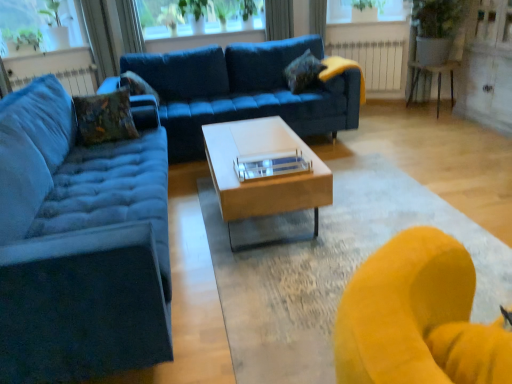
Question: Considering the relative sizes of velvet textured pillow at upper center, positioned as the third pillow in left-to-right order, and velvet blue couch at left, which is counted as the 2th studio couch, starting from the back, in the image provided, is velvet textured pillow at upper center, positioned as the third pillow in left-to-right order, wider than velvet blue couch at left, which is counted as the 2th studio couch, starting from the back,?

Choices:
 (A) no
 (B) yes

Answer: (A)

Question: Does velvet textured pillow at upper center, the third pillow in the front-to-back sequence, have a larger size compared to velvet blue couch at left, the 1th studio couch from the front?

Choices:
 (A) yes
 (B) no

Answer: (B)

Question: Can you confirm if velvet textured pillow at upper center, the third pillow in the front-to-back sequence, is positioned to the right of velvet blue couch at left, the 1th studio couch from the front?

Choices:
 (A) yes
 (B) no

Answer: (A)

Question: Could velvet blue couch at left, which is counted as the 2th studio couch, starting from the back, be considered to be inside velvet textured pillow at upper center, the 1th pillow from the right?

Choices:
 (A) no
 (B) yes

Answer: (A)

Question: Is velvet textured pillow at upper center, the third pillow in the front-to-back sequence, in front of velvet blue couch at left, which is counted as the 2th studio couch, starting from the back?

Choices:
 (A) yes
 (B) no

Answer: (B)

Question: In terms of size, does transparent glass window screen at upper left, marked as the second window screen in a right-to-left arrangement, appear bigger or smaller than velvet textured pillow at upper left, which is counted as the 2th pillow, starting from the right?

Choices:
 (A) big
 (B) small

Answer: (A)

Question: From a real-world perspective, is transparent glass window screen at upper left, which is the first window screen in left-to-right order, positioned above or below velvet textured pillow at upper left, which is the second pillow from front to back?

Choices:
 (A) below
 (B) above

Answer: (B)

Question: Is point (57, 6) closer or farther from the camera than point (134, 74)?

Choices:
 (A) farther
 (B) closer

Answer: (A)

Question: From their relative heights in the image, would you say transparent glass window screen at upper left, marked as the second window screen in a right-to-left arrangement, is taller or shorter than velvet textured pillow at upper left, which is the second pillow from front to back?

Choices:
 (A) tall
 (B) short

Answer: (A)

Question: From the image's perspective, is white metallic radiator at upper left, positioned as the first radiator in left-to-right order, above or below white glossy coffee table at center?

Choices:
 (A) above
 (B) below

Answer: (A)

Question: From a real-world perspective, is white metallic radiator at upper left, the 2th radiator in the back-to-front sequence, physically located above or below white glossy coffee table at center?

Choices:
 (A) above
 (B) below

Answer: (A)

Question: Considering their positions, is white metallic radiator at upper left, the 2th radiator in the back-to-front sequence, located in front of or behind white glossy coffee table at center?

Choices:
 (A) front
 (B) behind

Answer: (B)

Question: Is white metallic radiator at upper left, the second radiator positioned from the right, wider or thinner than white glossy coffee table at center?

Choices:
 (A) wide
 (B) thin

Answer: (B)

Question: Looking at their shapes, would you say white metallic radiator at center, which is counted as the second radiator, starting from the front, is wider or thinner than velvet textured pillow at upper left, which is the second pillow from front to back?

Choices:
 (A) wide
 (B) thin

Answer: (B)

Question: Considering the positions of point (332, 54) and point (131, 89), is point (332, 54) closer or farther from the camera than point (131, 89)?

Choices:
 (A) closer
 (B) farther

Answer: (B)